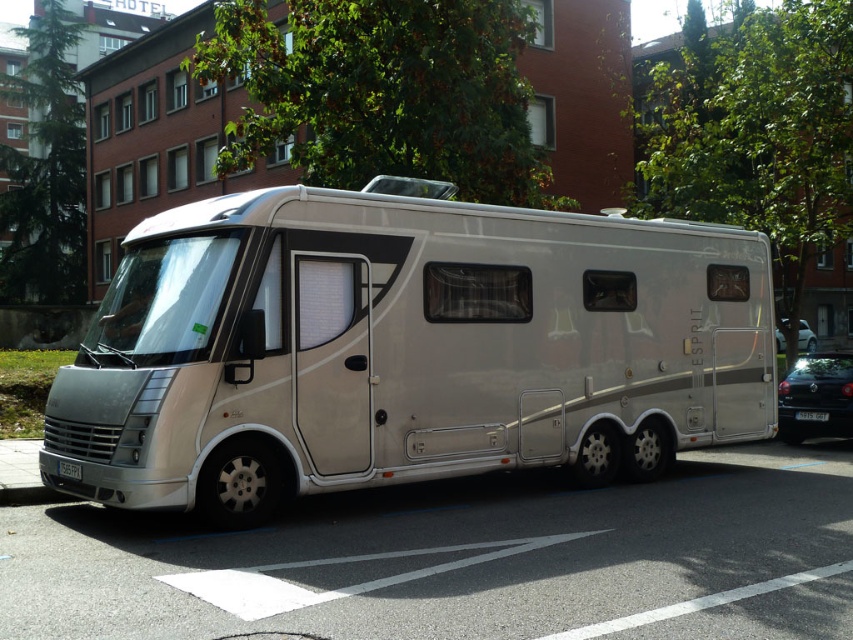
You are a delivery person trying to load a package onto the roof of the beige motorhome. You notice the black glossy sedan at lower right and the white plastic license plate at lower center. Which object is taller, and does this affect your ability to load the package?

The black glossy sedan at lower right is taller than the white plastic license plate at lower center. However, since the license plate is attached to the motorhome, the sedan height comparison doesn